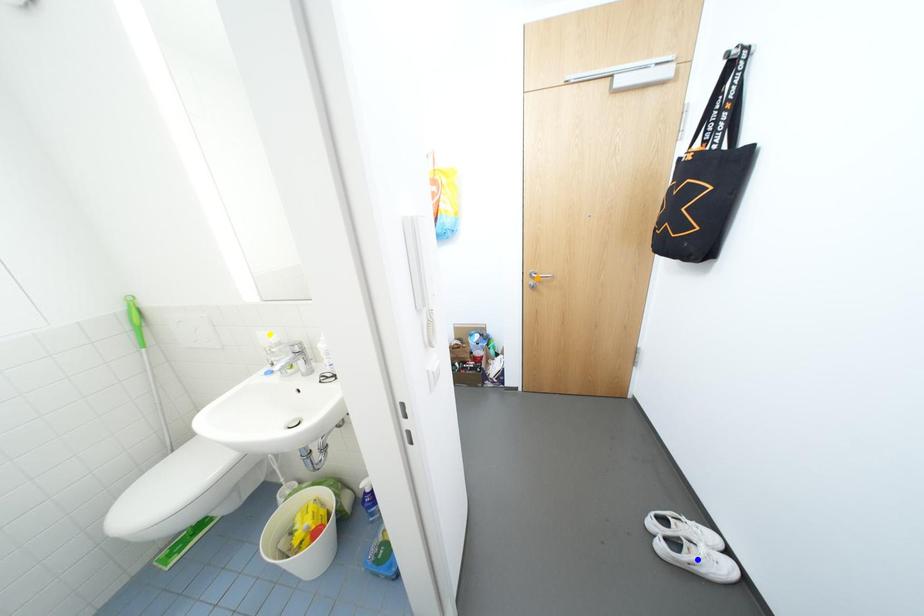
Order these from nearest to farthest:
yellow point
blue point
orange point

orange point → blue point → yellow point